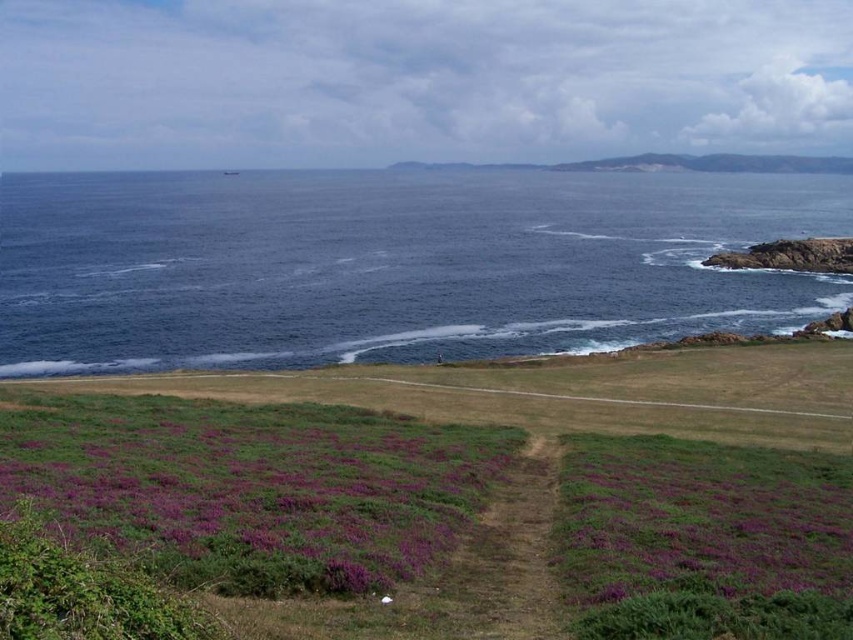
You are a hiker standing at the start of the dirt path leading to the coastline. You notice two patches of purple soft grass at lower left and purple soft grass at lower center. Which one is taller?

The purple soft grass at lower left is taller than the purple soft grass at lower center.

You are standing on the grassy area with purple flowers and want to walk to the rocky shore near the ocean. There are two points marked in the image. Which point, point (x=341, y=440) or point (x=677, y=445), is closer to you and would be the first to reach along your path?

Point (x=341, y=440) is closer to the viewer than point (x=677, y=445), so you would reach point (x=341, y=440) first along your path.